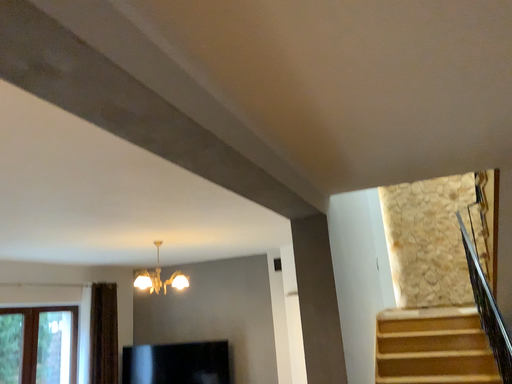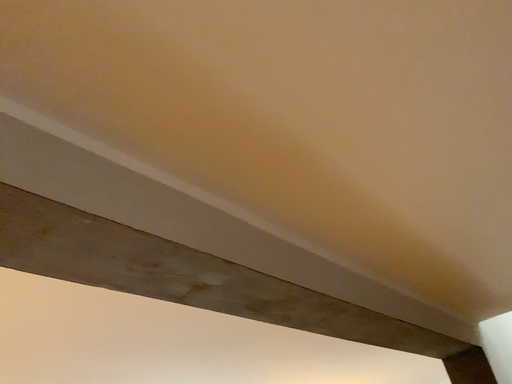
Question: How did the camera likely rotate when shooting the video?

Choices:
 (A) rotated downward
 (B) rotated upward

Answer: (B)